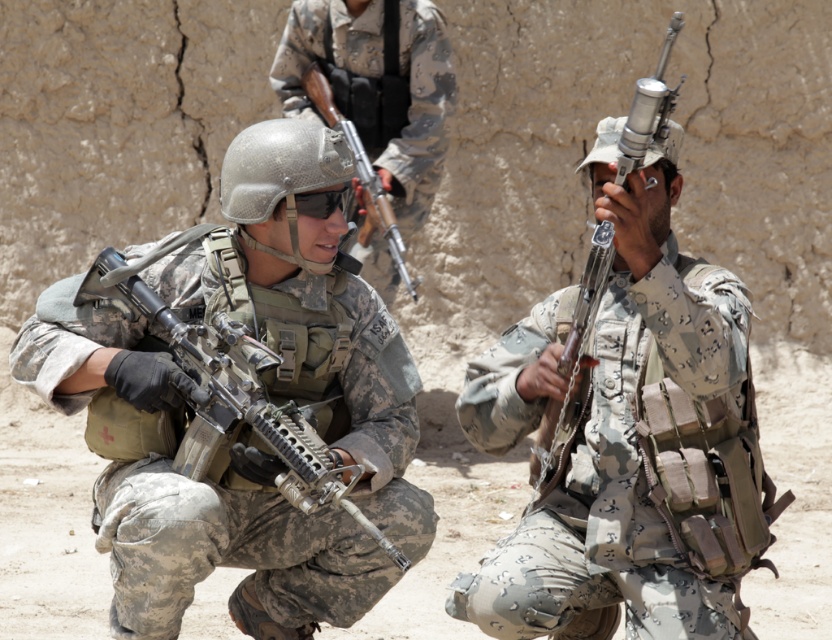
Question: Considering the real-world distances, which object is farthest from the matte black rifle at center?

Choices:
 (A) camouflage uniform at center
 (B) matte black rifle at left

Answer: (B)

Question: Which point is farther to the camera?

Choices:
 (A) [349, 481]
 (B) [449, 67]

Answer: (B)

Question: Can you confirm if camouflage fabric rifle at center is positioned below matte black rifle at left?

Choices:
 (A) no
 (B) yes

Answer: (A)

Question: Does camouflage fabric rifle at center have a greater width compared to matte black rifle at left?

Choices:
 (A) yes
 (B) no

Answer: (B)

Question: Which point is farther from the camera taking this photo?

Choices:
 (A) (750, 385)
 (B) (622, 134)
 (C) (201, 461)
 (D) (261, 160)

Answer: (C)

Question: Does camouflage uniform at center have a smaller size compared to silver metallic rifle at center?

Choices:
 (A) yes
 (B) no

Answer: (B)